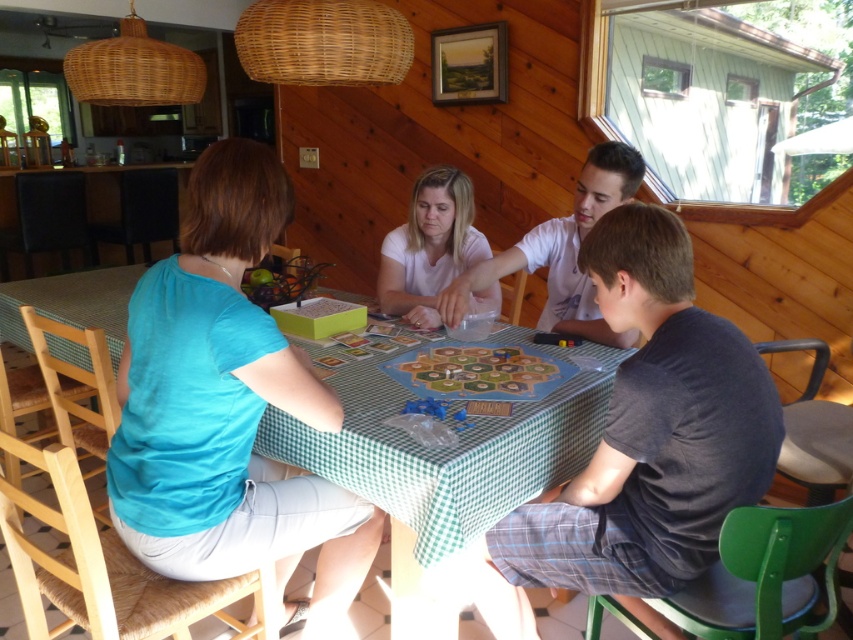
Is smooth white shirt at center behind white matte shirt at center?

No.

Does point (590, 172) lie behind point (450, 179)?

No, (590, 172) is in front of (450, 179).

What do you see at coordinates (561, 252) in the screenshot?
I see `smooth white shirt at center` at bounding box center [561, 252].

Where is `smooth white shirt at center`? smooth white shirt at center is located at coordinates (561, 252).

The width and height of the screenshot is (853, 640). Describe the element at coordinates (227, 406) in the screenshot. I see `teal fabric shirt at left` at that location.

Which of these two, teal fabric shirt at left or white matte shirt at center, stands taller?

teal fabric shirt at left is taller.

Locate an element on the screen. The height and width of the screenshot is (640, 853). teal fabric shirt at left is located at coordinates (227, 406).

You are a GUI agent. You are given a task and a screenshot of the screen. Output one action in this format:
    pyautogui.click(x=<x>, y=<y>)
    Task: Click on the teal fabric shirt at left
    This screenshot has height=640, width=853.
    Given the screenshot: What is the action you would take?
    pyautogui.click(x=227, y=406)

Who is shorter, dark gray cotton shirt at center or white matte shirt at center?

white matte shirt at center

Is dark gray cotton shirt at center positioned in front of white matte shirt at center?

That is True.

Is point (671, 516) positioned in front of point (392, 246)?

Yes, point (671, 516) is closer to viewer.

In order to click on dark gray cotton shirt at center in this screenshot , I will do `click(653, 433)`.